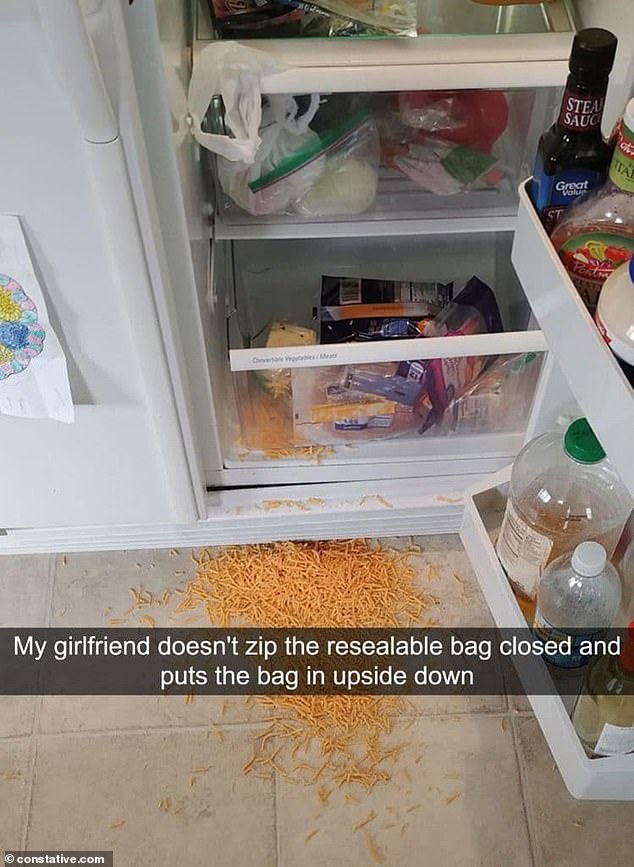
Where is `pile of shredded cheese on floor`? The width and height of the screenshot is (634, 867). pile of shredded cheese on floor is located at coordinates (313, 592).